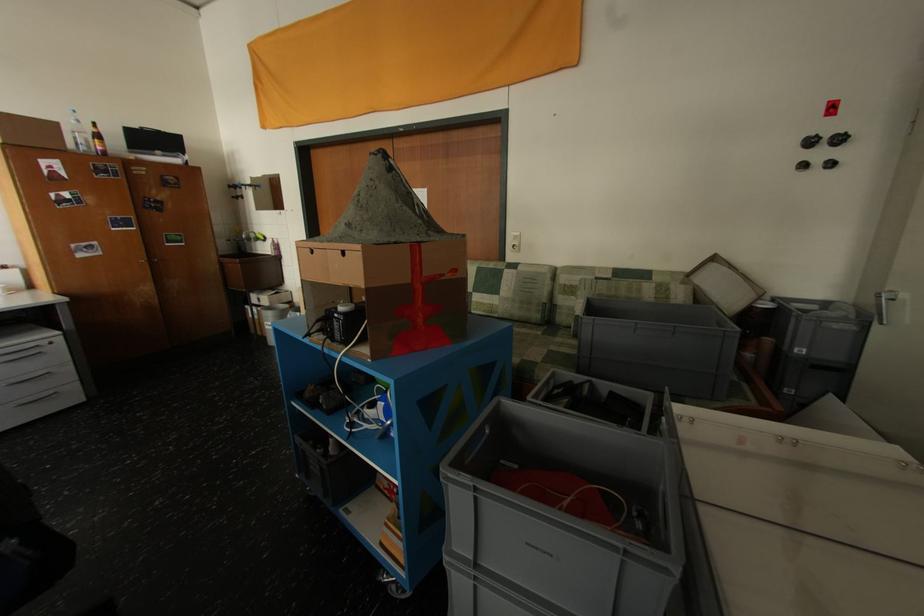
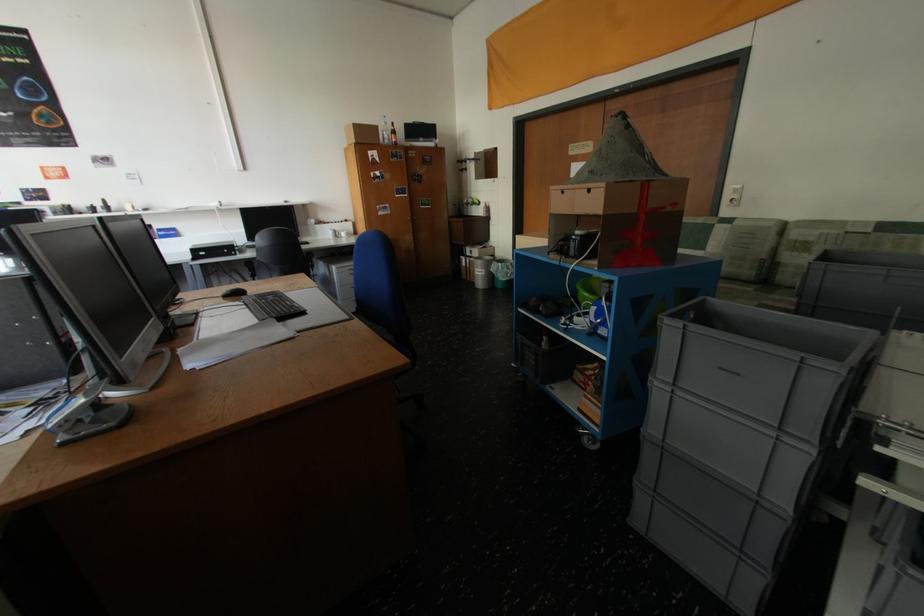
Locate, in the second image, the point that corresponds to pixel 64 127 in the first image.

(384, 129)